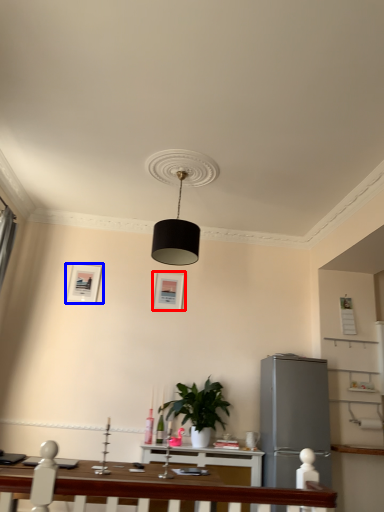
Question: Which object appears farthest to the camera in this image, picture frame (highlighted by a red box) or picture frame (highlighted by a blue box)?

Choices:
 (A) picture frame
 (B) picture frame

Answer: (A)